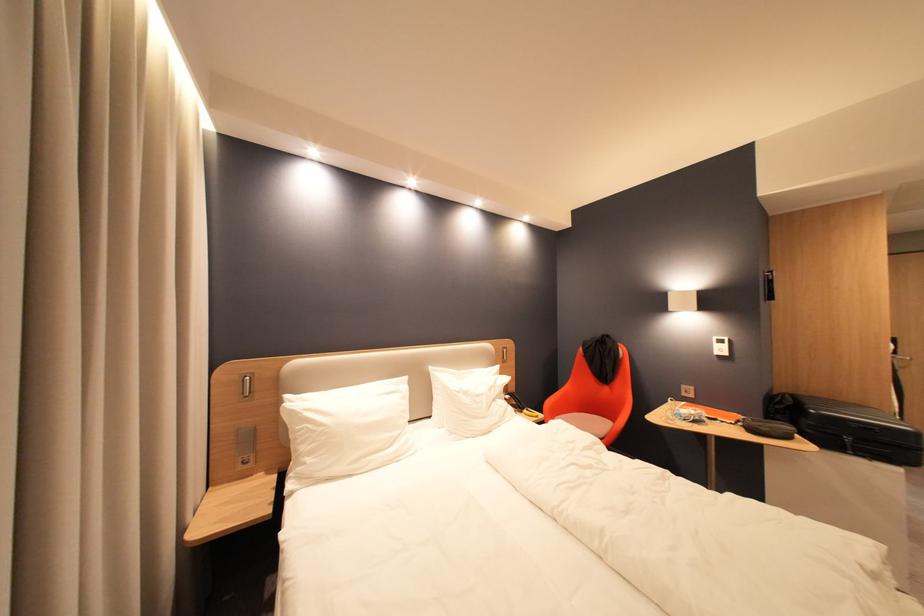
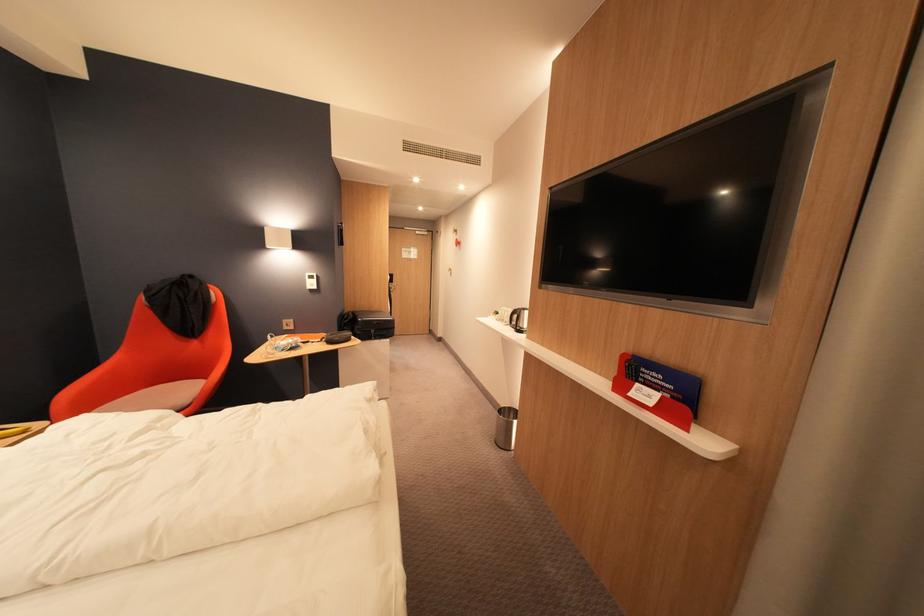
Where in the second image is the point corresponding to (821,413) from the first image?

(370, 321)